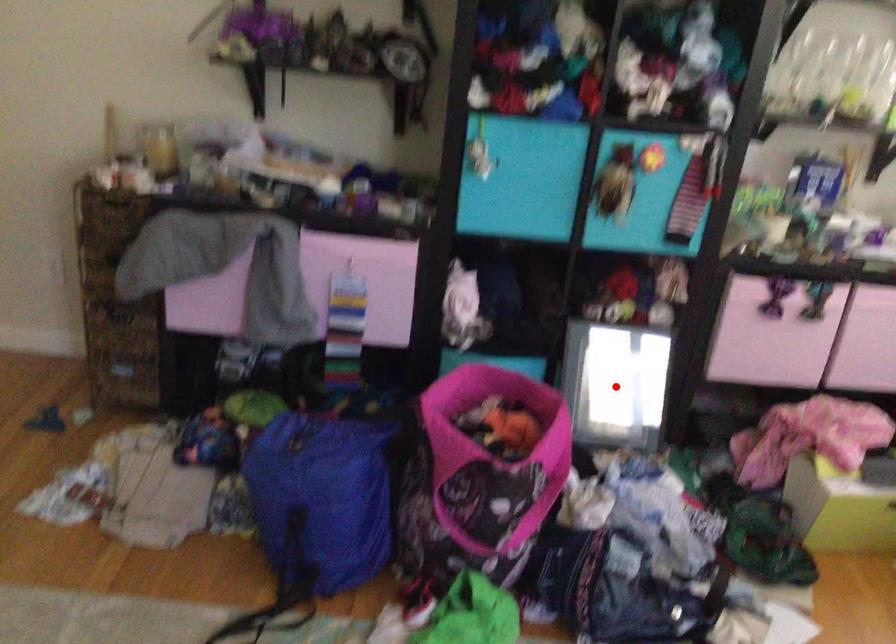
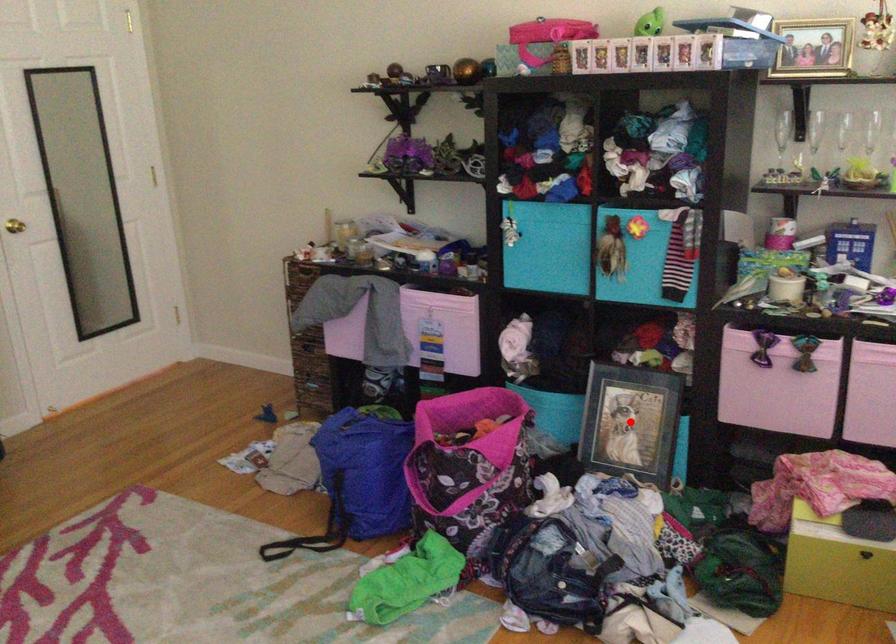
I am providing you with two images of the same scene from different viewpoints. A red point is marked on the first image and another point is marked on the second image. Do the highlighted points in image1 and image2 indicate the same real-world spot?

Yes